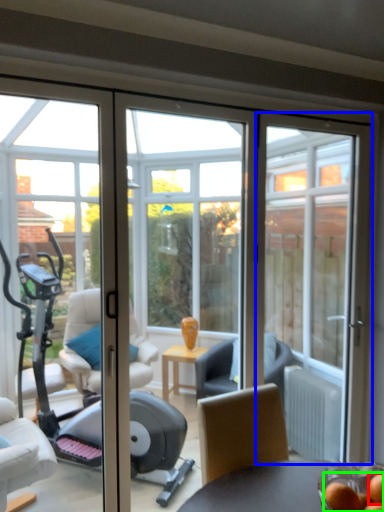
Question: Based on their relative distances, which object is farther from food (highlighted by a red box)? Choose from door (highlighted by a blue box) and food (highlighted by a green box).

Choices:
 (A) door
 (B) food

Answer: (A)